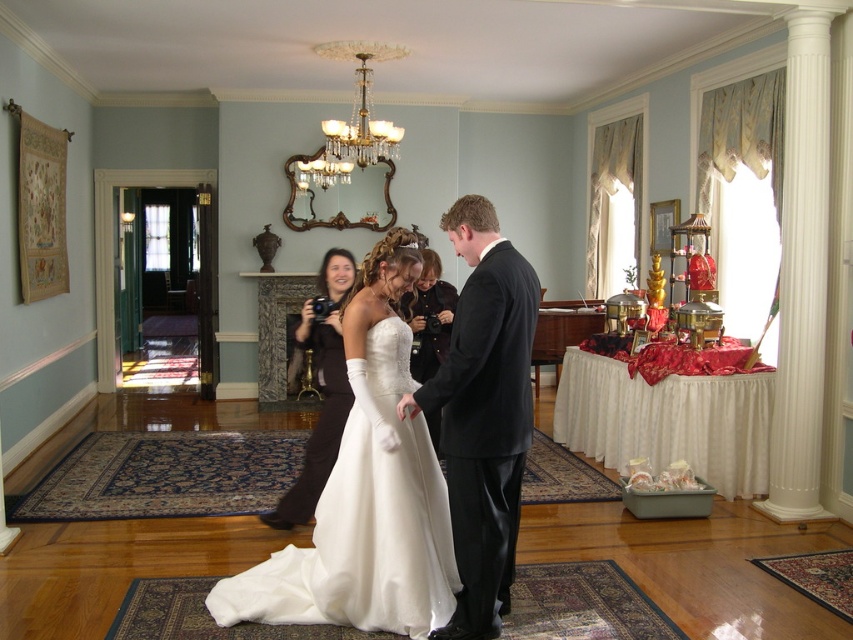
Does point (431, 605) lie in front of point (347, 260)?

Yes, it is.

You are a GUI agent. You are given a task and a screenshot of the screen. Output one action in this format:
    pyautogui.click(x=<x>, y=<y>)
    Task: Click on the white satin dress at center
    Image resolution: width=853 pixels, height=640 pixels.
    Given the screenshot: What is the action you would take?
    pyautogui.click(x=364, y=520)

I want to click on white satin dress at center, so click(364, 520).

Does shiny black suit at center appear on the left side of crystal glass chandelier at upper center?

In fact, shiny black suit at center is to the right of crystal glass chandelier at upper center.

Is point (456, 218) closer to camera compared to point (389, 140)?

Yes, it is.

Locate an element on the screen. shiny black suit at center is located at coordinates tap(483, 413).

Is white satin dress at center in front of crystal glass chandelier at upper center?

Yes, white satin dress at center is closer to the viewer.

In the scene shown: Is white satin dress at center further to camera compared to crystal glass chandelier at upper center?

That is False.

Is point (364, 556) more distant than point (393, 154)?

No.

Identify the location of white satin dress at center. (364, 520).